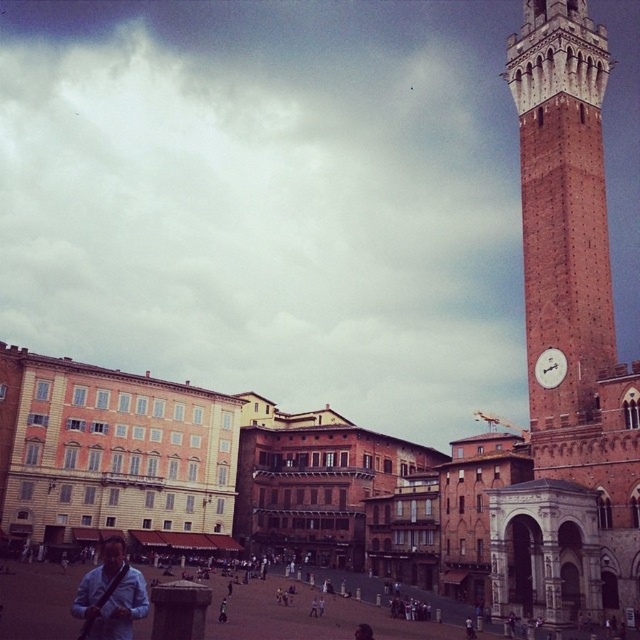
Question: Estimate the real-world distances between objects in this image. Which object is farther from the matte brick town square at center?

Choices:
 (A) white glossy clock at upper right
 (B) brick clock tower at right

Answer: (B)

Question: Is blue fabric bag at lower left below white glossy clock at upper right?

Choices:
 (A) no
 (B) yes

Answer: (B)

Question: Which object appears farthest from the camera in this image?

Choices:
 (A) brick clock tower at right
 (B) matte brick town square at center

Answer: (A)

Question: Does brick clock tower at right have a greater width compared to white glossy clock at upper right?

Choices:
 (A) yes
 (B) no

Answer: (A)

Question: Which of the following is the farthest from the observer?

Choices:
 (A) (548, 616)
 (B) (561, 376)

Answer: (B)

Question: Does matte brick town square at center have a larger size compared to blue fabric bag at lower left?

Choices:
 (A) no
 (B) yes

Answer: (B)